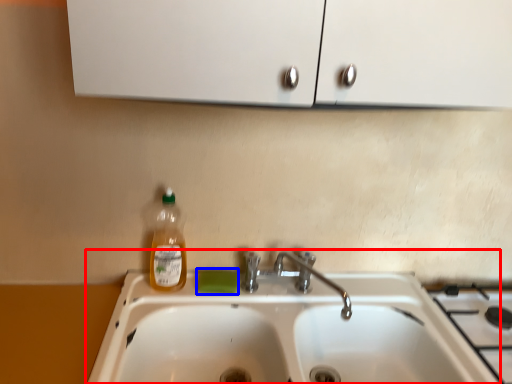
Question: Which point is further to the camera, sink (highlighted by a red box) or soap (highlighted by a blue box)?

Choices:
 (A) sink
 (B) soap

Answer: (B)